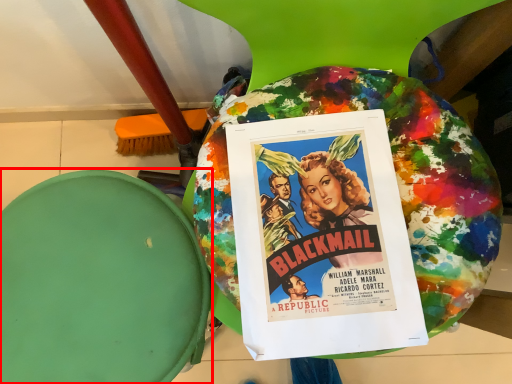
Question: From the image's perspective, what is the correct spatial positioning of bean bag chair (annotated by the red box) in reference to poster?

Choices:
 (A) below
 (B) above

Answer: (A)